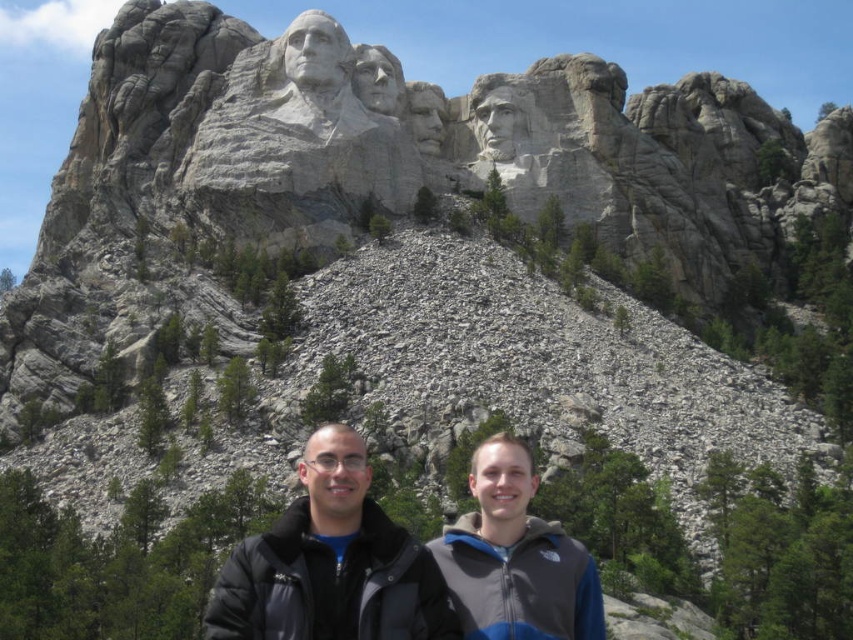
Question: Which point is farther to the camera?

Choices:
 (A) (451, 596)
 (B) (508, 448)
 (C) (300, 102)

Answer: (C)

Question: Which point is closer to the camera?

Choices:
 (A) black jacket at center
 (B) granite statue at upper center
 (C) gray fleece jacket at lower right

Answer: (A)

Question: Is black jacket at center closer to the viewer compared to gray fleece jacket at lower right?

Choices:
 (A) yes
 (B) no

Answer: (A)

Question: Which point is farther to the camera?

Choices:
 (A) (526, 472)
 (B) (538, 531)

Answer: (A)

Question: Does black jacket at center have a smaller size compared to gray fleece jacket at lower right?

Choices:
 (A) no
 (B) yes

Answer: (A)

Question: Is black jacket at center to the left of gray fleece jacket at lower right from the viewer's perspective?

Choices:
 (A) no
 (B) yes

Answer: (B)